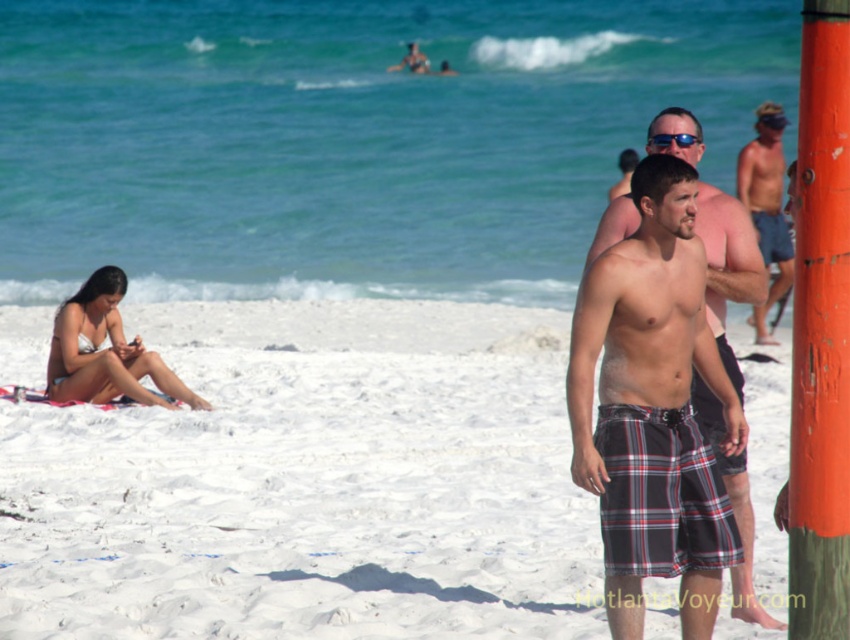
You are designing a safety inspection checklist for beach lifeguards. You need to note the width of the orange painted wood post at right and plaid shorts at center. Which object is narrower?

The orange painted wood post at right is narrower than the plaid shorts at center.

You are standing at the edge of the beach and want to walk towards the plaid shorts at center. Will you step on the white sand at lower left first?

Yes, because the white sand at lower left is closer to you than the plaid shorts at center, so you would step on it first while walking towards the plaid shorts at center.